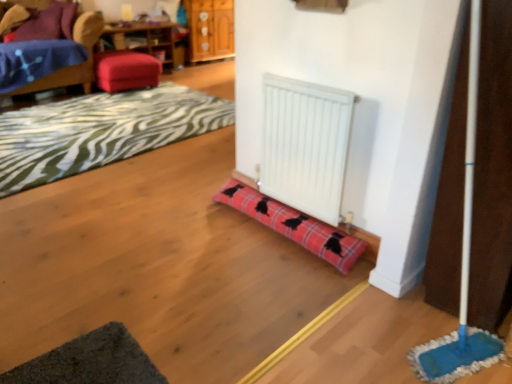
Question: In the image, is white matte radiator at center on the left side or the right side of wooden dresser at upper center?

Choices:
 (A) right
 (B) left

Answer: (A)

Question: Does point (271, 180) appear closer or farther from the camera than point (230, 39)?

Choices:
 (A) closer
 (B) farther

Answer: (A)

Question: Estimate the real-world distances between objects in this image. Which object is farther from the white matte radiator at center?

Choices:
 (A) dark gray textured yoga mat at lower left
 (B) blue fabric couch at upper left
 (C) velvet red stool at upper left
 (D) wooden table at upper left
 (E) wooden dresser at upper center

Answer: (E)

Question: Which object is the closest to the wooden table at upper left?

Choices:
 (A) velvet red stool at upper left
 (B) white matte radiator at center
 (C) plaid fabric mat at lower left
 (D) blue fabric couch at upper left
 (E) red plaid doorstop at center

Answer: (A)